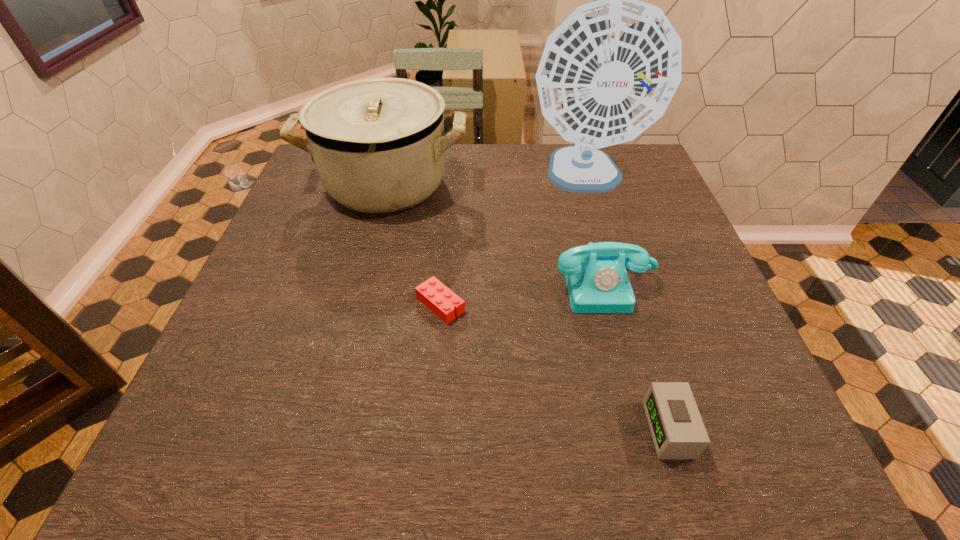
This screenshot has height=540, width=960. I want to click on the tallest object, so click(x=609, y=71).

This screenshot has width=960, height=540. In order to click on saucepan in this screenshot , I will do `click(378, 144)`.

Where is `telephone`? telephone is located at coordinates (597, 281).

This screenshot has width=960, height=540. In order to click on alarm clock in this screenshot , I will do `click(678, 432)`.

I want to click on the nearest object, so pos(678,432).

The height and width of the screenshot is (540, 960). I want to click on the shortest object, so click(443, 302).

Identify the location of vacant space located 0.330m on the grille of the fan. (624, 309).

The width and height of the screenshot is (960, 540). Find the location of `free spot located 0.230m on the front of the second tallest object`. free spot located 0.230m on the front of the second tallest object is located at coordinates (359, 292).

Image resolution: width=960 pixels, height=540 pixels. I want to click on free point located on the dial of the telephone, so click(637, 407).

The width and height of the screenshot is (960, 540). I want to click on vacant area situated 0.330m on the front-facing side of the nearest object, so click(x=454, y=429).